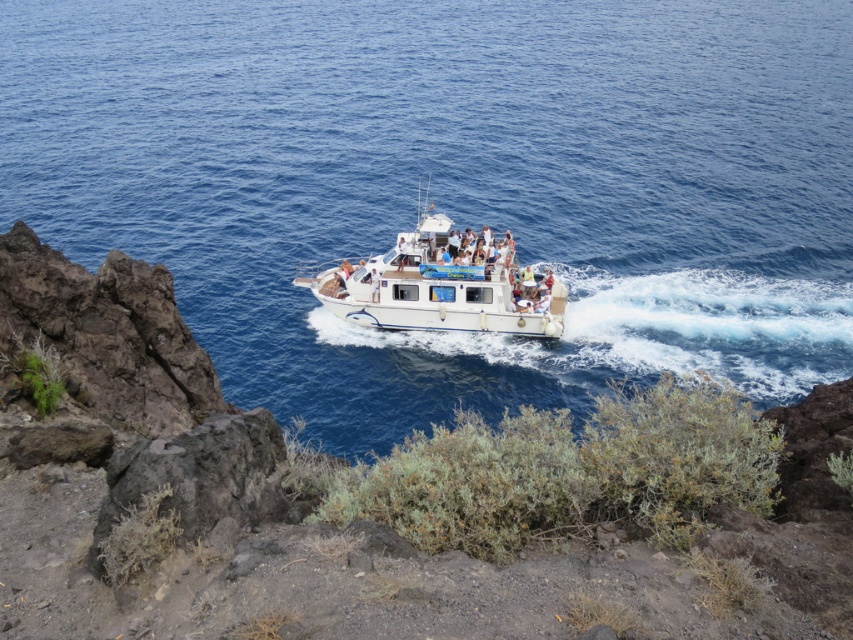
How much distance is there between blue water at center and white glossy boat at center?

45.60 feet

Is point (576, 346) farther from camera compared to point (425, 248)?

No, (576, 346) is in front of (425, 248).

Which is behind, point (0, 177) or point (495, 298)?

Positioned behind is point (0, 177).

Find the location of a particular element. This screenshot has width=853, height=640. blue water at center is located at coordinates (451, 184).